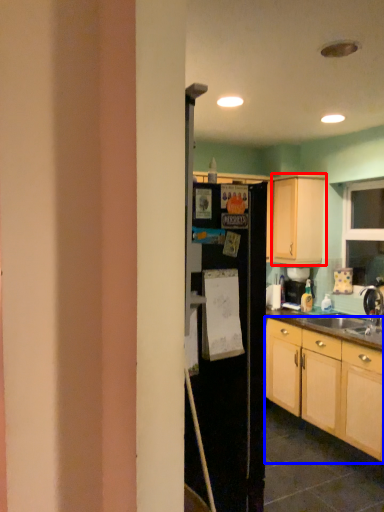
Question: Which of the following is the farthest to the observer, cabinetry (highlighted by a red box) or cabinetry (highlighted by a blue box)?

Choices:
 (A) cabinetry
 (B) cabinetry

Answer: (A)